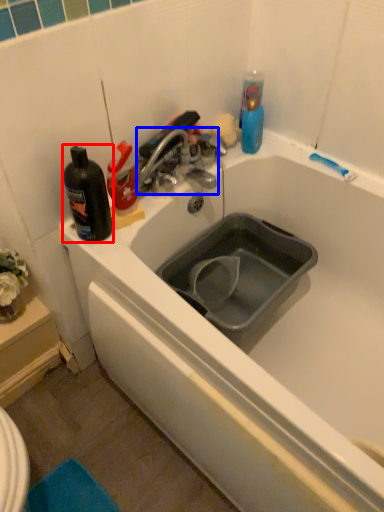
Question: Which of the following is the closest to the observer, bottle (highlighted by a red box) or tap (highlighted by a blue box)?

Choices:
 (A) bottle
 (B) tap

Answer: (A)